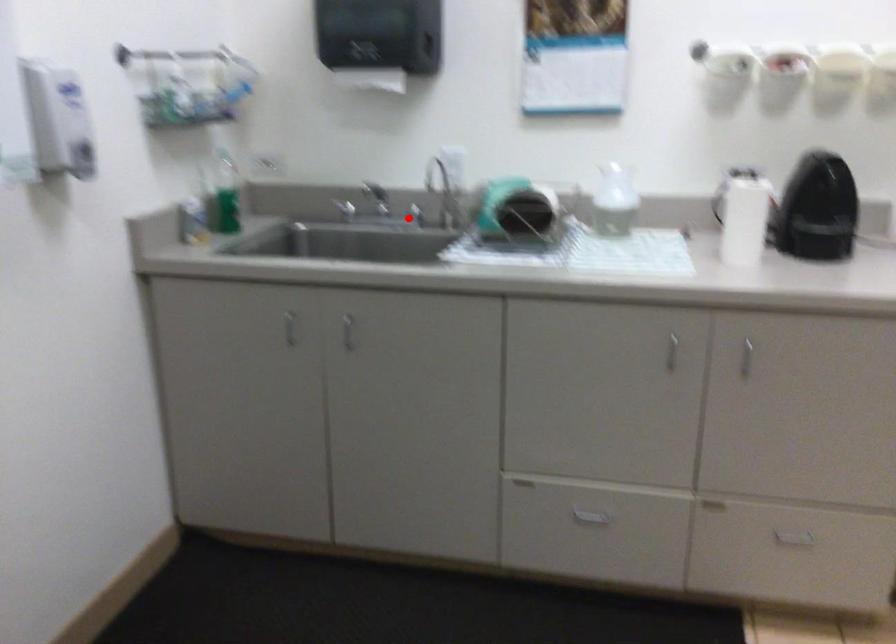
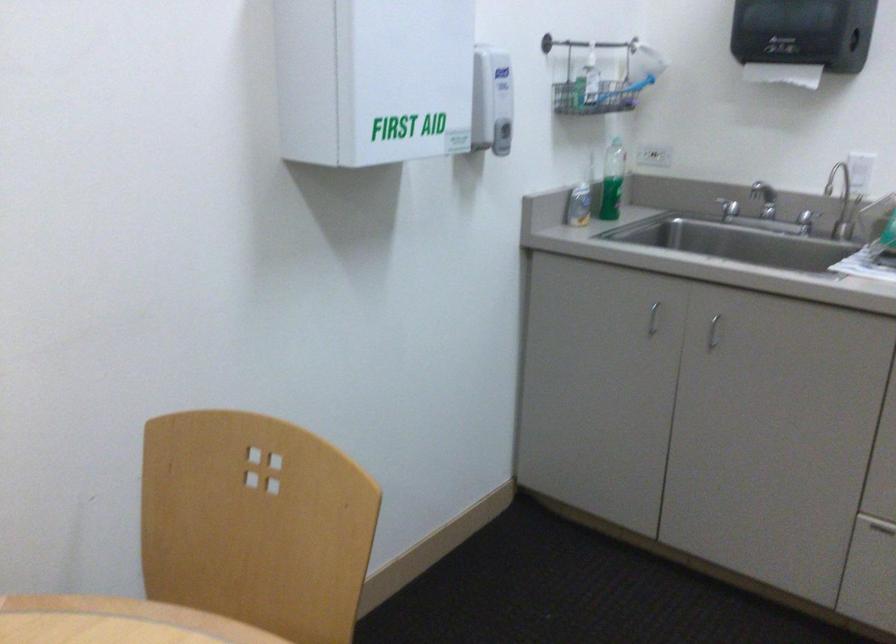
The point at the highlighted location is marked in the first image. Where is the corresponding point in the second image?

(806, 221)